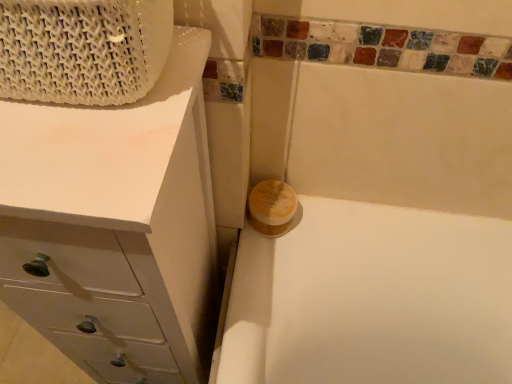
Image resolution: width=512 pixels, height=384 pixels. What do you see at coordinates (115, 224) in the screenshot? I see `white matte chest of drawers at upper left` at bounding box center [115, 224].

This screenshot has height=384, width=512. Find the location of `white woven basket at upper left`. white woven basket at upper left is located at coordinates (83, 49).

Which object is closer to the camera, white matte chest of drawers at upper left or white woven basket at upper left?

white woven basket at upper left is closer to the camera.

Is white matte chest of drawers at upper left positioned with its back to white woven basket at upper left?

That's not correct — white matte chest of drawers at upper left is not looking away from white woven basket at upper left.

From a real-world perspective, is white matte chest of drawers at upper left located beneath white woven basket at upper left?

Yes, from a real-world perspective, white matte chest of drawers at upper left is below white woven basket at upper left.

Which is further, (162, 297) or (16, 69)?

The point (162, 297) is more distant.

Which object is closer to the camera, yellow matte soap at center or white woven basket at upper left?

white woven basket at upper left.

Considering the positions of objects yellow matte soap at center and white woven basket at upper left in the image provided, who is more to the right, yellow matte soap at center or white woven basket at upper left?

From the viewer's perspective, yellow matte soap at center appears more on the right side.

From a real-world perspective, is yellow matte soap at center located higher than white woven basket at upper left?

No, from a real-world perspective, yellow matte soap at center is not over white woven basket at upper left

Is yellow matte soap at center turned away from white woven basket at upper left?

That's not correct — yellow matte soap at center is not looking away from white woven basket at upper left.

Looking at this image, considering the sizes of objects white woven basket at upper left and yellow matte soap at center in the image provided, who is shorter, white woven basket at upper left or yellow matte soap at center?

With less height is yellow matte soap at center.

Does white woven basket at upper left come behind yellow matte soap at center?

No, white woven basket at upper left is closer to the viewer.

Is white woven basket at upper left oriented towards yellow matte soap at center?

No, white woven basket at upper left is not oriented towards yellow matte soap at center.

Which of these two, white woven basket at upper left or yellow matte soap at center, is thinner?

Thinner between the two is yellow matte soap at center.

Which object is closer to the camera, white matte chest of drawers at upper left or yellow matte soap at center?

white matte chest of drawers at upper left is in front.

Is white matte chest of drawers at upper left shorter than yellow matte soap at center?

Incorrect, the height of white matte chest of drawers at upper left does not fall short of that of yellow matte soap at center.

Would you say white matte chest of drawers at upper left is inside or outside yellow matte soap at center?

white matte chest of drawers at upper left lies outside yellow matte soap at center.

Is white matte chest of drawers at upper left not close to yellow matte soap at center?

white matte chest of drawers at upper left is actually quite close to yellow matte soap at center.

Considering the relative positions of white woven basket at upper left and white matte chest of drawers at upper left in the image provided, is white woven basket at upper left to the left of white matte chest of drawers at upper left from the viewer's perspective?

Incorrect, white woven basket at upper left is not on the left side of white matte chest of drawers at upper left.

From the image's perspective, relative to white matte chest of drawers at upper left, is white woven basket at upper left above or below?

Clearly, from the image's perspective, white woven basket at upper left is above white matte chest of drawers at upper left.

Is white woven basket at upper left taller or shorter than white matte chest of drawers at upper left?

In the image, white woven basket at upper left appears to be shorter than white matte chest of drawers at upper left.

From the picture: Considering the relative sizes of white woven basket at upper left and white matte chest of drawers at upper left in the image provided, is white woven basket at upper left smaller than white matte chest of drawers at upper left?

Correct, white woven basket at upper left occupies less space than white matte chest of drawers at upper left.

Does point (273, 190) come farther from viewer compared to point (100, 190)?

Yes, it is behind point (100, 190).

Does yellow matte soap at center have a greater width compared to white matte chest of drawers at upper left?

No.

From the image's perspective, is yellow matte soap at center above or below white matte chest of drawers at upper left?

Based on their image positions, yellow matte soap at center is located above white matte chest of drawers at upper left.

Would you say white matte chest of drawers at upper left is part of yellow matte soap at center's contents?

No, white matte chest of drawers at upper left is not a part of yellow matte soap at center.

Find the location of a particular element. The width and height of the screenshot is (512, 384). basket located above the white matte chest of drawers at upper left (from the image's perspective) is located at coordinates (83, 49).

Where is `soap on the right side of white woven basket at upper left`? The width and height of the screenshot is (512, 384). soap on the right side of white woven basket at upper left is located at coordinates (271, 207).

When comparing their distances from white matte chest of drawers at upper left, does yellow matte soap at center or white woven basket at upper left seem closer?

Among the two, white woven basket at upper left is located nearer to white matte chest of drawers at upper left.

From the image, which object appears to be nearer to white matte chest of drawers at upper left, white woven basket at upper left or yellow matte soap at center?

white woven basket at upper left is positioned closer to the anchor white matte chest of drawers at upper left.

When comparing their distances from white woven basket at upper left, does white matte chest of drawers at upper left or yellow matte soap at center seem further?

Among the two, yellow matte soap at center is located further to white woven basket at upper left.

Estimate the real-world distances between objects in this image. Which object is further from yellow matte soap at center, white matte chest of drawers at upper left or white woven basket at upper left?

white woven basket at upper left is further to yellow matte soap at center.

When comparing their distances from yellow matte soap at center, does white woven basket at upper left or white matte chest of drawers at upper left seem closer?

Based on the image, white matte chest of drawers at upper left appears to be nearer to yellow matte soap at center.

Which object lies nearer to the anchor point white woven basket at upper left, yellow matte soap at center or white matte chest of drawers at upper left?

white matte chest of drawers at upper left lies closer to white woven basket at upper left than the other object.

At what (x,y) coordinates should I click in order to perform the action: click on the chest of drawers positioned between white woven basket at upper left and yellow matte soap at center from near to far. Please return your answer as a coordinate pair (x, y). This screenshot has height=384, width=512. Looking at the image, I should click on (115, 224).